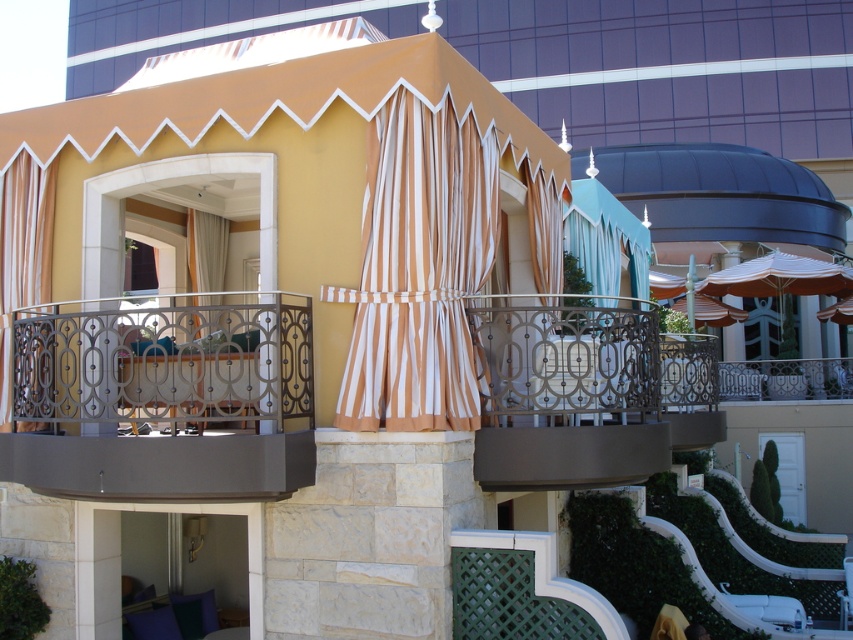
From the picture: You are an interior designer assessing the balcony decor. You notice the brown and white striped curtain at center and the beige striped curtain at left. Which curtain is wider?

The brown and white striped curtain at center is wider than the beige striped curtain at left.